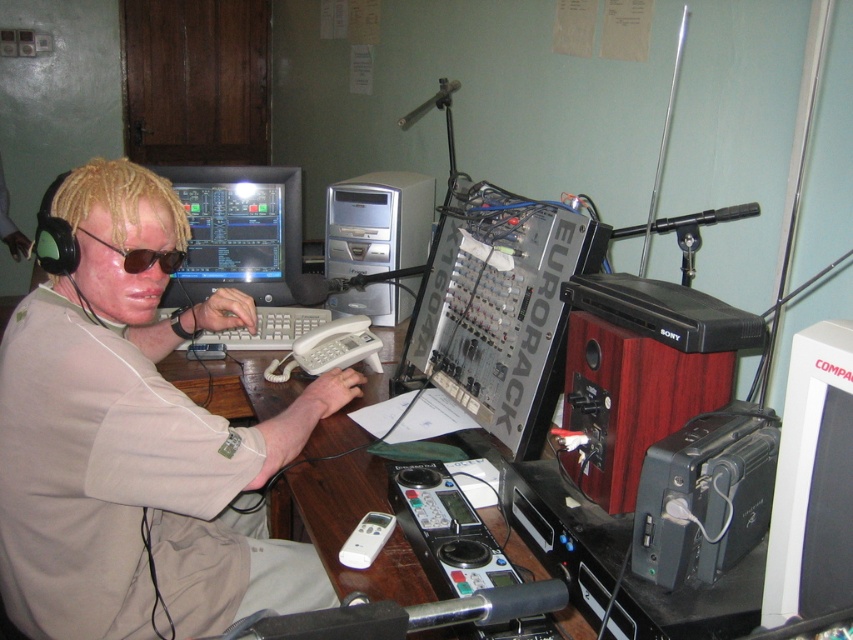
Which is in front, point (117, 356) or point (804, 458)?

Positioned in front is point (804, 458).

I want to click on matte beige shirt at center, so click(135, 442).

The height and width of the screenshot is (640, 853). In order to click on matte beige shirt at center in this screenshot , I will do `click(135, 442)`.

Find the location of `matte beige shirt at center`. matte beige shirt at center is located at coordinates (135, 442).

Which of these two, silver metallic desktop computer at center or black matte sunglasses at left, stands taller?

Standing taller between the two is silver metallic desktop computer at center.

Between point (347, 234) and point (167, 252), which one is positioned in front?

Point (167, 252) is in front.

You are a GUI agent. You are given a task and a screenshot of the screen. Output one action in this format:
    pyautogui.click(x=<x>, y=<y>)
    Task: Click on the silver metallic desktop computer at center
    
    Given the screenshot: What is the action you would take?
    pyautogui.click(x=376, y=221)

Does white plastic monitor at right have a greater width compared to matte black monitor at center?

Incorrect, white plastic monitor at right's width does not surpass matte black monitor at center's.

Image resolution: width=853 pixels, height=640 pixels. In order to click on white plastic monitor at right in this screenshot , I will do `click(811, 481)`.

At what (x,y) coordinates should I click in order to perform the action: click on white plastic monitor at right. Please return your answer as a coordinate pair (x, y). Image resolution: width=853 pixels, height=640 pixels. Looking at the image, I should click on (811, 481).